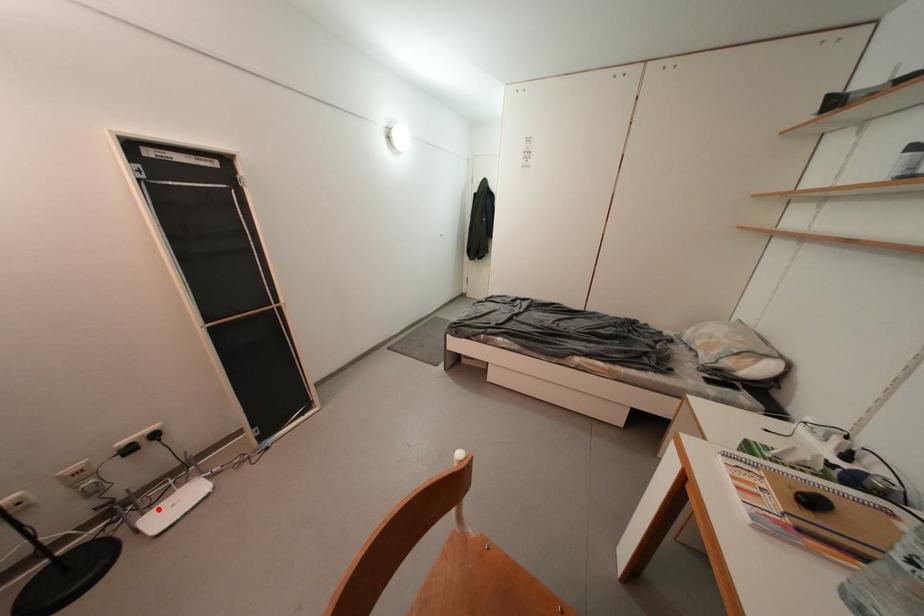
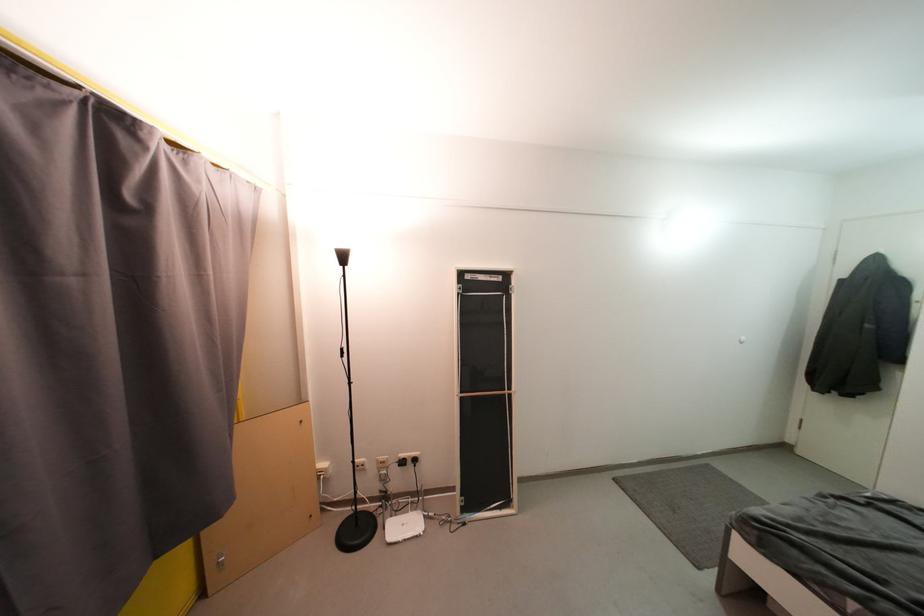
Locate, in the second image, the point that corresponds to the highlighted location in the first image.

(405, 515)